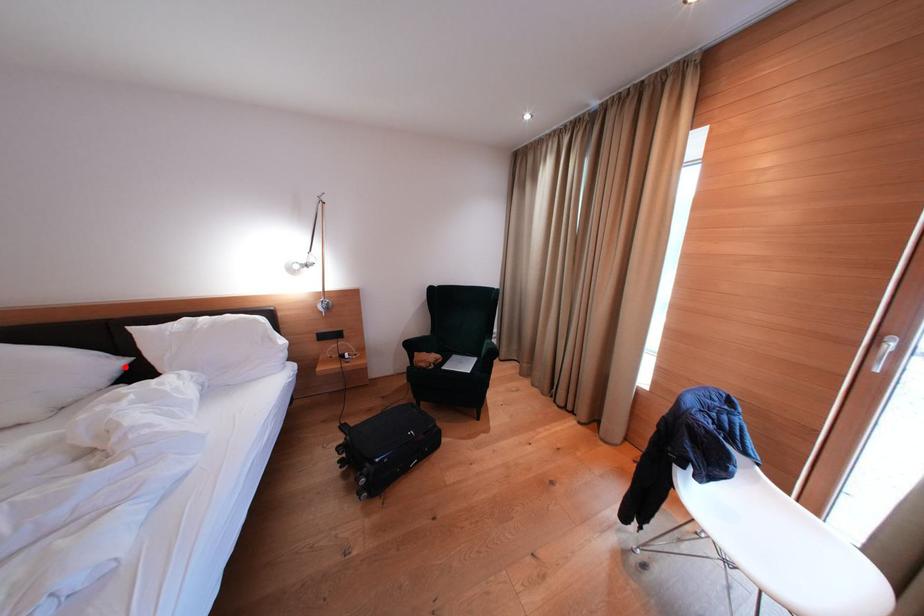
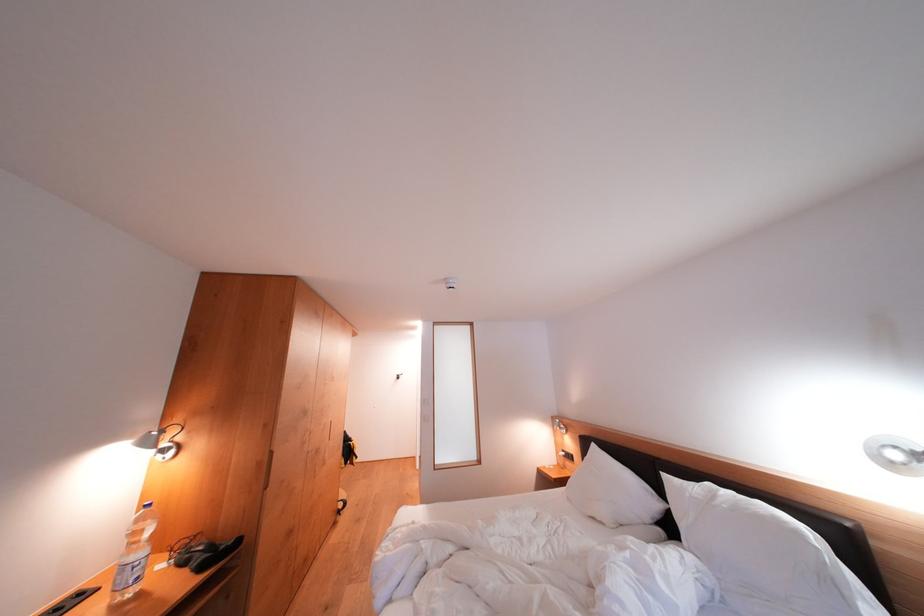
In the second image, find the point that corresponds to the highlighted location in the first image.

(664, 509)